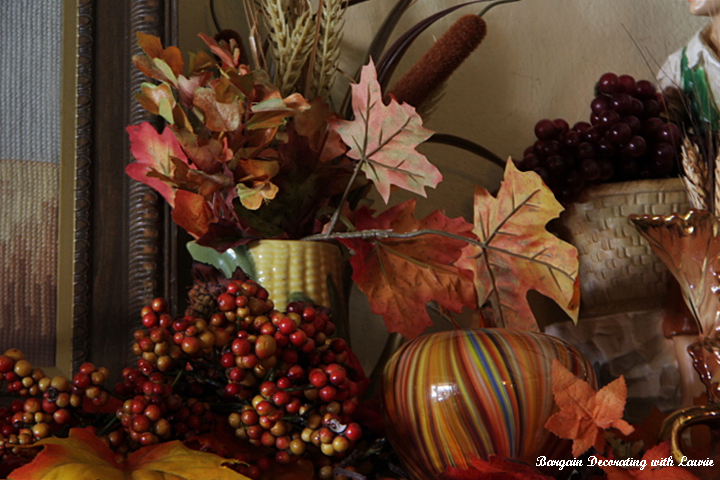
This screenshot has height=480, width=720. In order to click on vase that looks like corn in this screenshot , I will do `click(294, 274)`.